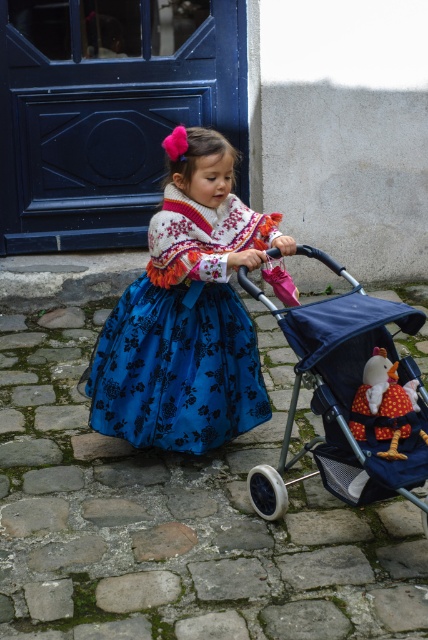
You are a photographer trying to capture the girl and the stroller in the image. The stroller is located at point (332, 387). If you want to frame the girl and the stroller together, where should you position your camera relative to the girl?

The point (332, 387) indicates the matte blue stroller at center. To frame both the girl and the stroller together, position the camera centrally so that the girl and the stroller at point (332, 387) are both in the frame.

You are standing at the origin of the coordinate system in the image. You see two points, point [189,230] and point [348,323]. Which point is closer to you?

Point [189,230] is behind point [348,323], so point [348,323] is closer to you.

You are a photographer trying to capture the girl in the blue satin dress at center without the stroller blocking her. Can you adjust your position to ensure the dress is fully visible without the matte blue stroller at center obstructing the view?

The blue satin dress at center is positioned over the matte blue stroller at center, so moving to a lower angle would allow the dress to be seen without obstruction from the stroller.